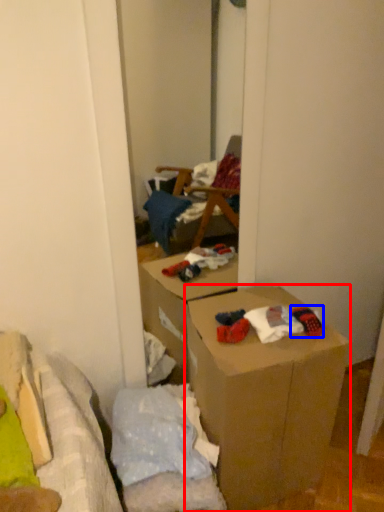
Question: Which point is closer to the camera, box (highlighted by a red box) or toy (highlighted by a blue box)?

Choices:
 (A) box
 (B) toy

Answer: (A)